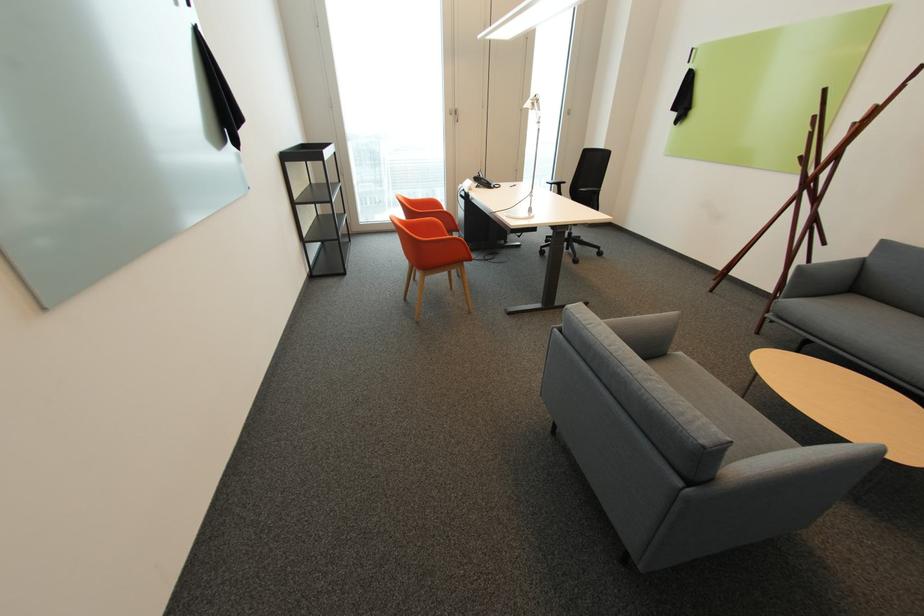
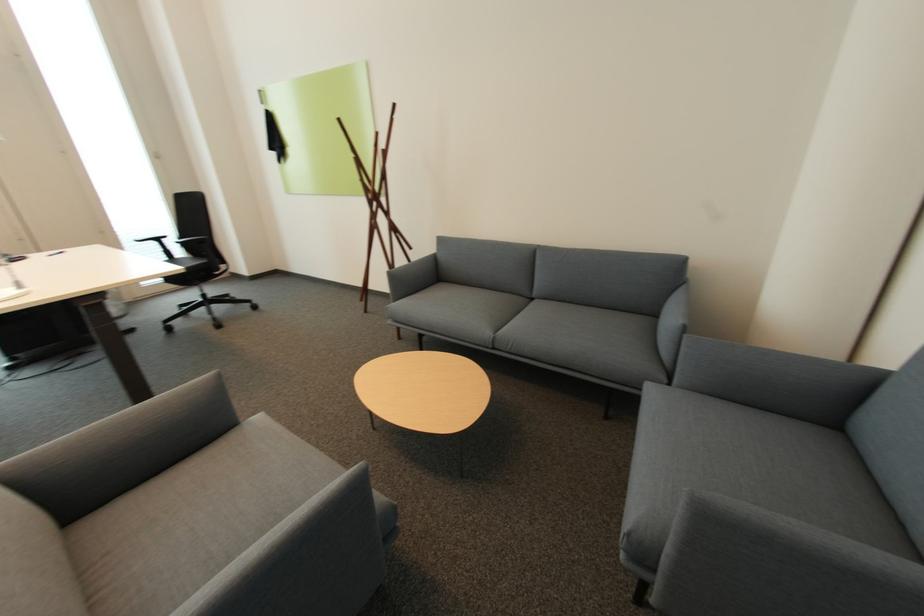
Question: Based on the continuous images, in which direction is the camera rotating? Reply with the corresponding letter.

Choices:
 (A) Left
 (B) Right
 (C) Up
 (D) Down

Answer: (B)